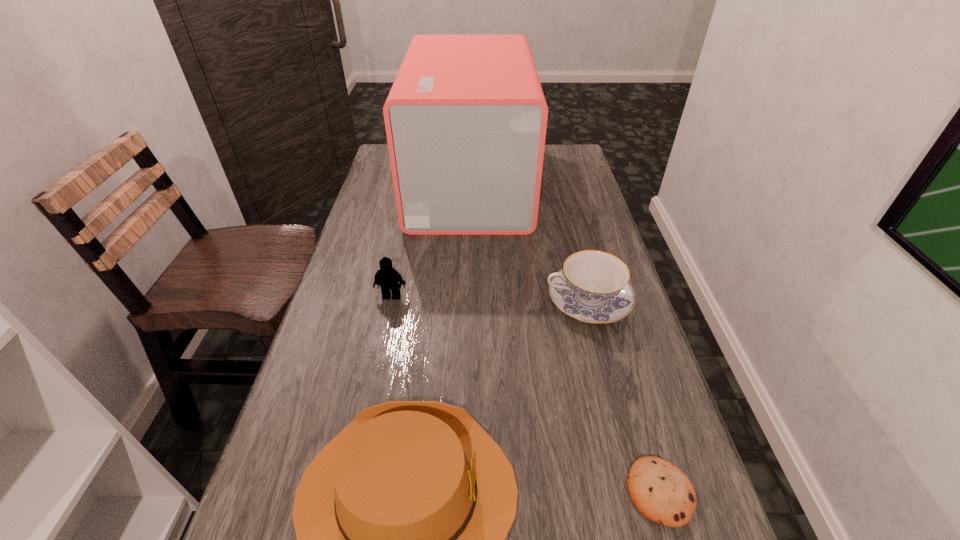
The height and width of the screenshot is (540, 960). In the image, there is a desktop. What are the coordinates of `blank space at the far right corner` in the screenshot? It's located at (554, 168).

The width and height of the screenshot is (960, 540). I want to click on free space between the Lego and the cookie, so click(526, 394).

At what (x,y) coordinates should I click in order to perform the action: click on free point between the Lego and the chinaware. Please return your answer as a coordinate pair (x, y). The width and height of the screenshot is (960, 540). Looking at the image, I should click on (490, 299).

What are the coordinates of `free spot between the Lego and the cookie` in the screenshot? It's located at (526, 394).

At what (x,y) coordinates should I click in order to perform the action: click on blank region between the cookie and the tallest object. Please return your answer as a coordinate pair (x, y). This screenshot has width=960, height=540. Looking at the image, I should click on [565, 338].

This screenshot has height=540, width=960. Find the location of `vacant region between the tallest object and the chinaware`. vacant region between the tallest object and the chinaware is located at coordinates (529, 242).

I want to click on free point between the Lego and the box, so click(431, 240).

The image size is (960, 540). I want to click on vacant area that lies between the shortest object and the farthest object, so click(565, 338).

Find the location of a particular element. vacant space in between the cookie and the chinaware is located at coordinates (624, 396).

Image resolution: width=960 pixels, height=540 pixels. I want to click on free point between the cookie and the Lego, so click(526, 394).